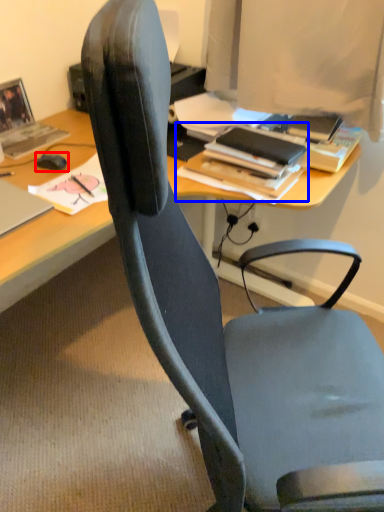
Question: Which point is closer to the camera, mouse (highlighted by a red box) or book (highlighted by a blue box)?

Choices:
 (A) mouse
 (B) book

Answer: (B)